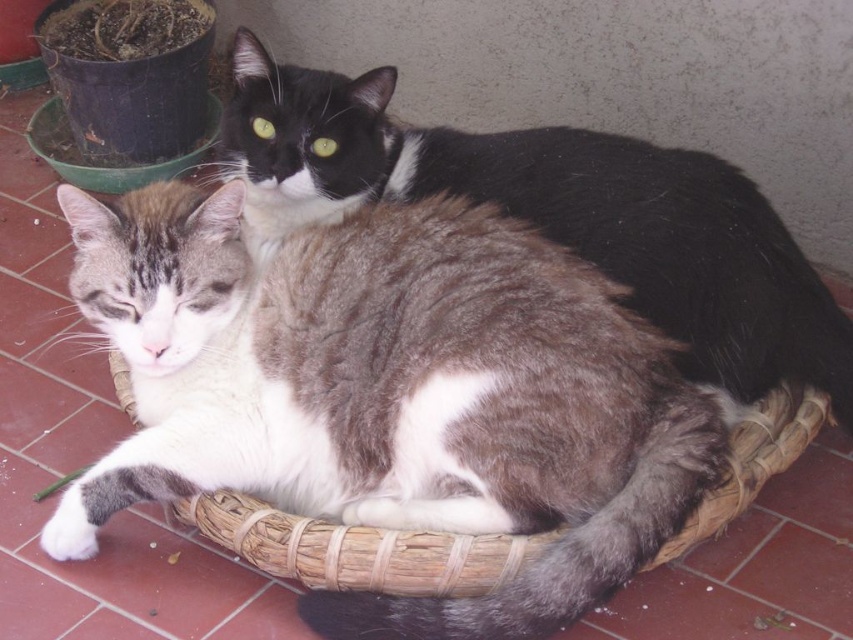
You are a photographer trying to capture a closeup of the gray and white fur cat at center. Since the woven straw basket at center is in the way, can you move the basket to get a better shot? Explain why or why not based on their sizes.

The gray and white fur cat at center is narrower than the woven straw basket at center, so moving the basket might be possible without disturbing the cat if the photographer carefully shifts the basket sideways. However, since the basket is at the center, moving it could also displace the cat. The photographer should assess whether the cat is comfortable with the adjustment.